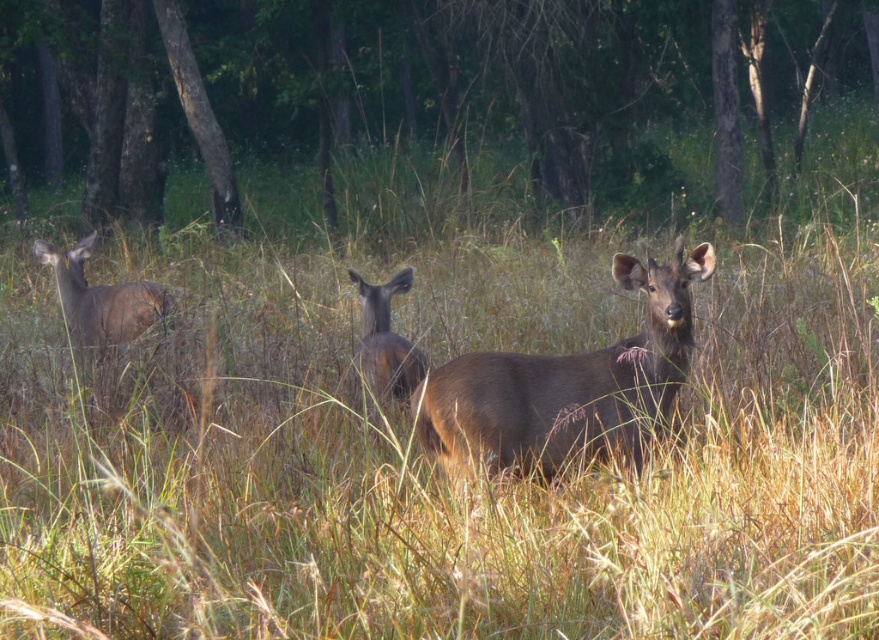
Question: Which of the following is the closest to the observer?

Choices:
 (A) (55, 253)
 (B) (509, 362)
 (C) (586, 120)

Answer: (B)

Question: Does green grass at center have a lesser width compared to brown matte deer at center?

Choices:
 (A) no
 (B) yes

Answer: (A)

Question: Which of the following is the closest to the observer?

Choices:
 (A) (85, 228)
 (B) (365, 388)
 (C) (469, 426)

Answer: (C)

Question: Does brown matte deer at left have a smaller size compared to brown matte/deer at center?

Choices:
 (A) no
 (B) yes

Answer: (A)

Question: Is brown matte deer at left to the right of brown matte/deer at center from the viewer's perspective?

Choices:
 (A) yes
 (B) no

Answer: (B)

Question: Estimate the real-world distances between objects in this image. Which object is farther from the green grass at center?

Choices:
 (A) brown matte/deer at center
 (B) brown matte deer at left
 (C) brown matte deer at center

Answer: (C)